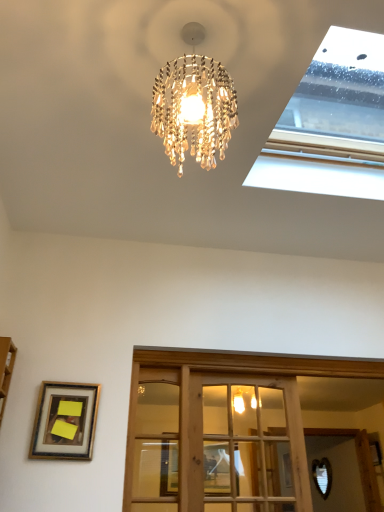
Find the location of `matte black picture frame at left`. matte black picture frame at left is located at coordinates (65, 422).

In order to face matte black picture frame at left, should I rotate leftwards or rightwards?

To align with it, rotate left about 16.279°.

The image size is (384, 512). What do you see at coordinates (65, 422) in the screenshot? I see `matte black picture frame at left` at bounding box center [65, 422].

The image size is (384, 512). I want to click on matte black picture frame at left, so click(65, 422).